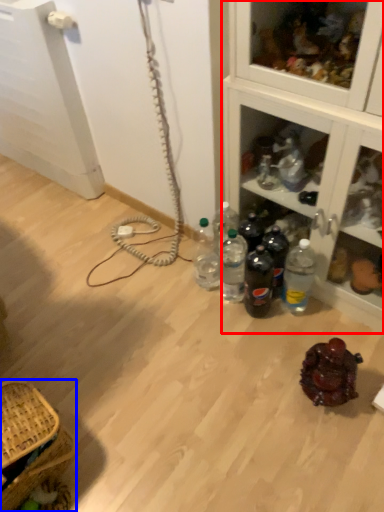
Question: Which point is closer to the camera, cabinetry (highlighted by a red box) or picnic basket (highlighted by a blue box)?

Choices:
 (A) cabinetry
 (B) picnic basket

Answer: (A)